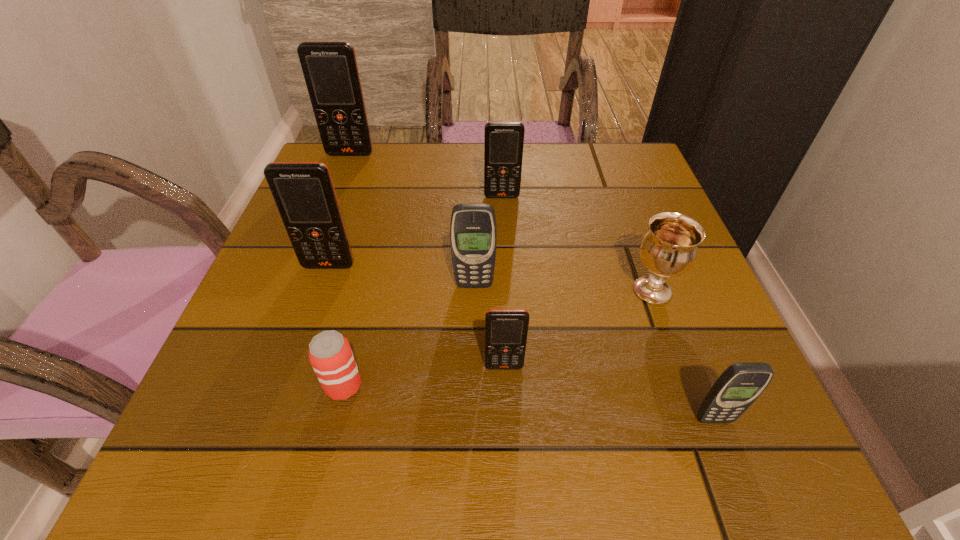
I want to click on the farthest object, so click(330, 69).

Find the location of a particular element. The height and width of the screenshot is (540, 960). the farthest cellular telephone is located at coordinates (330, 69).

The width and height of the screenshot is (960, 540). Find the location of `the second biggest orange cellular telephone`. the second biggest orange cellular telephone is located at coordinates (304, 193).

Find the location of `the second tallest object`. the second tallest object is located at coordinates (304, 193).

You are a GUI agent. You are given a task and a screenshot of the screen. Output one action in this format:
    pyautogui.click(x=<x>, y=<y>)
    Task: Click on the third nearest cellular telephone
    
    Given the screenshot: What is the action you would take?
    pyautogui.click(x=473, y=233)

This screenshot has height=540, width=960. Identify the location of the bigger gray cellular telephone. (473, 233).

Identify the location of the second farthest object. The height and width of the screenshot is (540, 960). (503, 141).

What are the coordinates of `the second farthest cellular telephone` in the screenshot? It's located at (503, 141).

Identify the location of chalice. (669, 249).

Find the location of `the second nearest cellular telephone`. the second nearest cellular telephone is located at coordinates (506, 330).